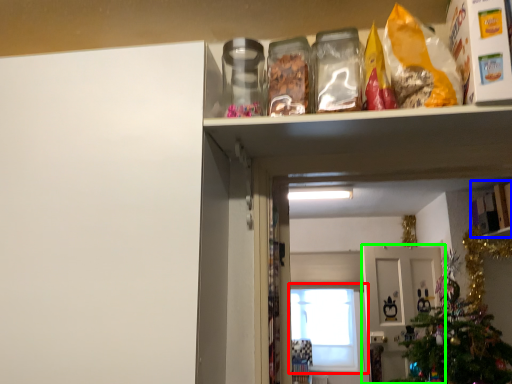
Question: Which is farther away from window (highlighted by a red box)? cabinet (highlighted by a blue box) or door (highlighted by a green box)?

Choices:
 (A) cabinet
 (B) door

Answer: (A)